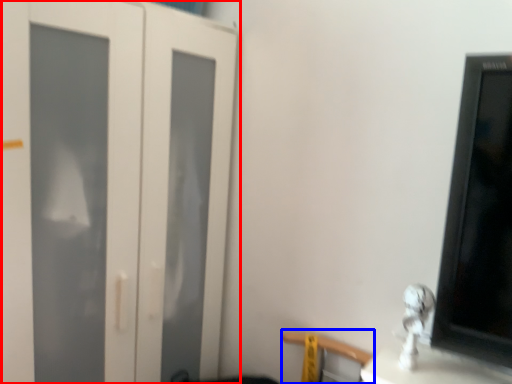
Question: Which object appears closest to the camera in this image, door (highlighted by a red box) or chair (highlighted by a blue box)?

Choices:
 (A) door
 (B) chair

Answer: (A)